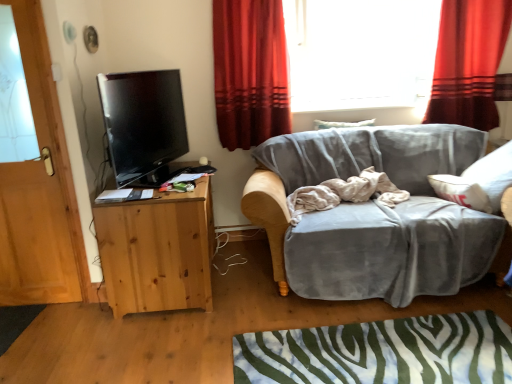
Question: From a real-world perspective, is beige cotton blanket at center above or below wooden door at left?

Choices:
 (A) above
 (B) below

Answer: (B)

Question: Relative to wooden door at left, is beige cotton blanket at center in front or behind?

Choices:
 (A) front
 (B) behind

Answer: (B)

Question: Which is farther from the beige cotton blanket at center?

Choices:
 (A) transparent glass window at upper center
 (B) green and white zebra-patterned rug at lower center
 (C) natural wood cabinet at left
 (D) wooden door at left
 (E) matte black tv at left

Answer: (D)

Question: Considering the real-world distances, which object is closest to the velvet gray couch at center?

Choices:
 (A) wooden door at left
 (B) beige cotton blanket at center
 (C) red velvet curtain at upper right, which is the 2th curtain in left-to-right order
 (D) natural wood cabinet at left
 (E) red velvet curtain at upper center, which is counted as the 1th curtain, starting from the left

Answer: (B)